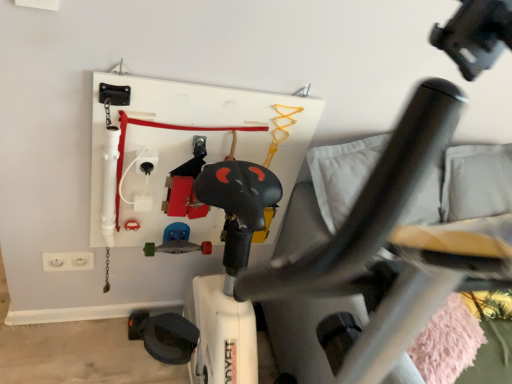
Question: From the image's perspective, is black plastic swivel chair at center positioned above or below metallic silver skateboard at center?

Choices:
 (A) above
 (B) below

Answer: (B)

Question: Which is correct: black plastic swivel chair at center is inside metallic silver skateboard at center, or outside of it?

Choices:
 (A) outside
 (B) inside

Answer: (A)

Question: Which object is the closest to the white plastic electrical outlet at lower left?

Choices:
 (A) black plastic swivel chair at center
 (B) metallic silver skateboard at center

Answer: (B)

Question: Based on their relative distances, which object is farther from the white plastic electrical outlet at lower left?

Choices:
 (A) black plastic swivel chair at center
 (B) metallic silver skateboard at center

Answer: (A)